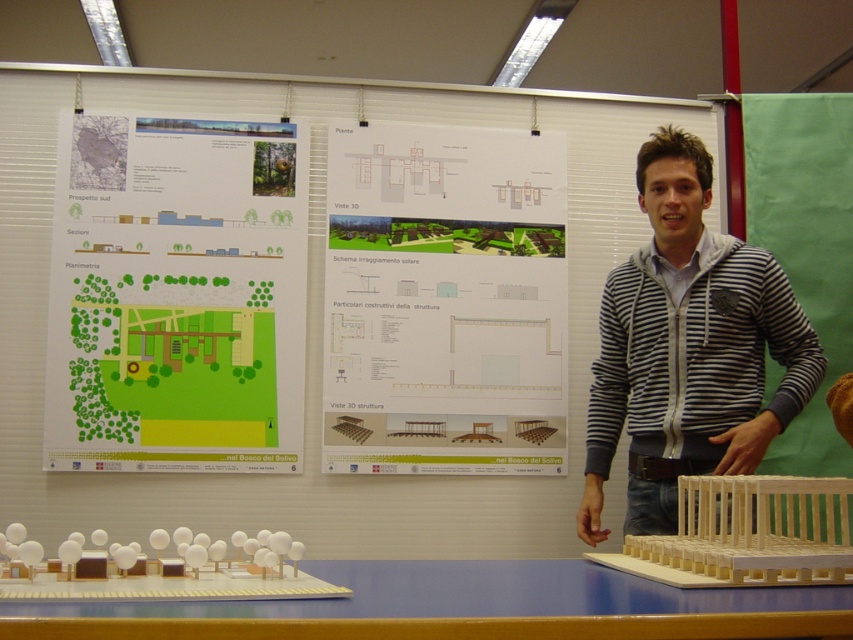
You are an architect reviewing the presentation materials. You notice two papers on the posters. Which paper is taller, the green paper at upper left or the white paper at center?

The green paper at upper left is taller than the white paper at center.

You are an architect reviewing a presentation. You notice two papers on the table. The green paper at upper left and the white paper at center. Which one is positioned to the left?

The green paper at upper left is positioned to the left of the white paper at center.

You are an architect attending a presentation. You notice the green paper at upper left and the striped hoodie at center in the scene. Which object is closer to you?

The green paper at upper left is closer to you because it is further to the viewer than the striped hoodie at center.